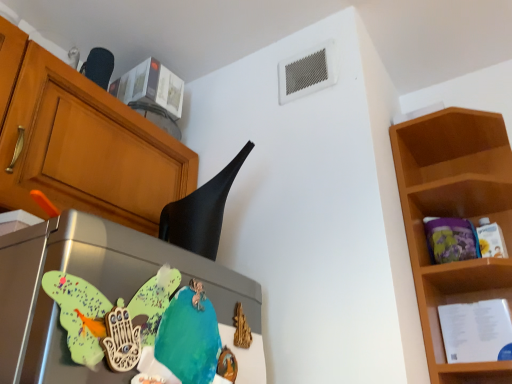
Question: Is black matte exhaust hood at upper center at the right side of metallic refrigerator at center-left?

Choices:
 (A) no
 (B) yes

Answer: (B)

Question: Can we say black matte exhaust hood at upper center lies outside metallic refrigerator at center-left?

Choices:
 (A) yes
 (B) no

Answer: (A)

Question: From a real-world perspective, is black matte exhaust hood at upper center on metallic refrigerator at center-left?

Choices:
 (A) yes
 (B) no

Answer: (A)

Question: Would you say metallic refrigerator at center-left is part of black matte exhaust hood at upper center's contents?

Choices:
 (A) yes
 (B) no

Answer: (B)

Question: Does black matte exhaust hood at upper center have a smaller size compared to metallic refrigerator at center-left?

Choices:
 (A) yes
 (B) no

Answer: (B)

Question: Can you see black matte exhaust hood at upper center touching metallic refrigerator at center-left?

Choices:
 (A) yes
 (B) no

Answer: (B)

Question: From a real-world perspective, does wooden shelf at right stand above metallic refrigerator at center-left?

Choices:
 (A) no
 (B) yes

Answer: (B)

Question: Considering the relative positions of wooden shelf at right and metallic refrigerator at center-left in the image provided, is wooden shelf at right in front of metallic refrigerator at center-left?

Choices:
 (A) yes
 (B) no

Answer: (B)

Question: Is wooden shelf at right positioned beyond the bounds of metallic refrigerator at center-left?

Choices:
 (A) no
 (B) yes

Answer: (B)

Question: Can you confirm if wooden shelf at right is thinner than metallic refrigerator at center-left?

Choices:
 (A) no
 (B) yes

Answer: (A)

Question: Is wooden shelf at right at the right side of metallic refrigerator at center-left?

Choices:
 (A) no
 (B) yes

Answer: (B)

Question: Does wooden shelf at right have a larger size compared to metallic refrigerator at center-left?

Choices:
 (A) no
 (B) yes

Answer: (B)

Question: Is black matte exhaust hood at upper center oriented away from wooden shelf at right?

Choices:
 (A) yes
 (B) no

Answer: (B)